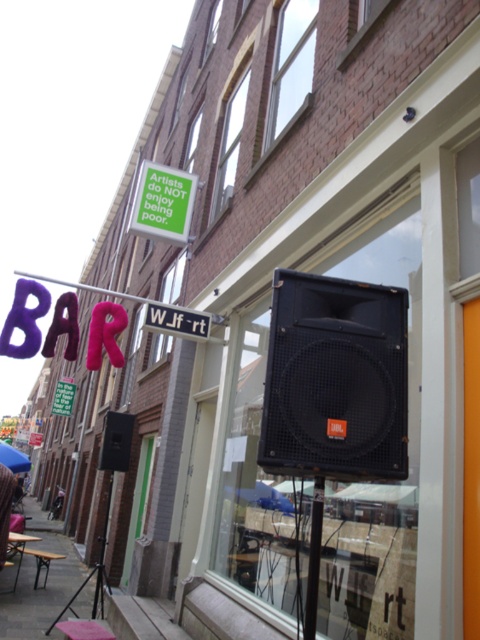
You are a delivery person who needs to hang a new sign between the purple fabric sign at upper left and the green paper sign at upper left. The new sign is 3 feet wide. Is there enough space between them to place the new sign?

The purple fabric sign at upper left and green paper sign at upper left are 43.68 feet apart from each other, so yes, there is enough space between them to place the new sign that is 3 feet wide.

You are a customer entering the cafe and see the purple fabric sign at upper left and the pink fabric stool at lower left. Which object is higher up in the image?

The purple fabric sign at upper left is above the pink fabric stool at lower left, so it is higher up in the image.